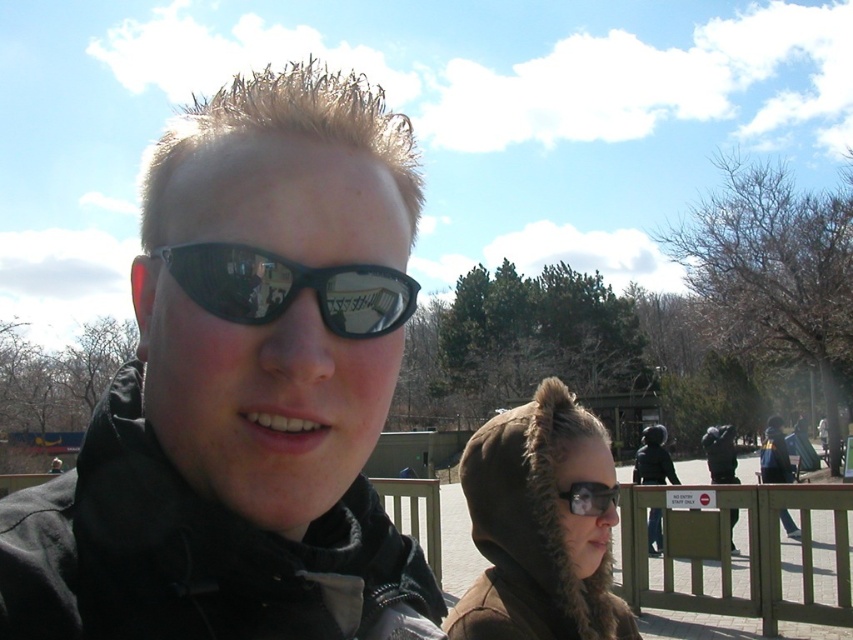
Question: Can you confirm if brown fur-lined hood at center is positioned to the right of brown fur-lined coat at lower right?

Choices:
 (A) no
 (B) yes

Answer: (A)

Question: Estimate the real-world distances between objects in this image. Which object is closer to the wooden fence at lower right?

Choices:
 (A) matte black sunglasses at center
 (B) brown fur-lined coat at lower right
 (C) matte black goggles at center
 (D) black reflective sunglasses at center

Answer: (B)

Question: Is matte black sunglasses at center below black reflective sunglasses at center?

Choices:
 (A) yes
 (B) no

Answer: (B)

Question: Based on their relative distances, which object is farther from the brown fur-lined hood at center?

Choices:
 (A) matte black goggles at center
 (B) matte black sunglasses at center

Answer: (B)

Question: Can you confirm if wooden fence at lower right is wider than matte black goggles at center?

Choices:
 (A) no
 (B) yes

Answer: (B)

Question: Which object is farther from the camera taking this photo?

Choices:
 (A) brown fur-lined hood at center
 (B) brown fur-lined coat at lower right

Answer: (B)